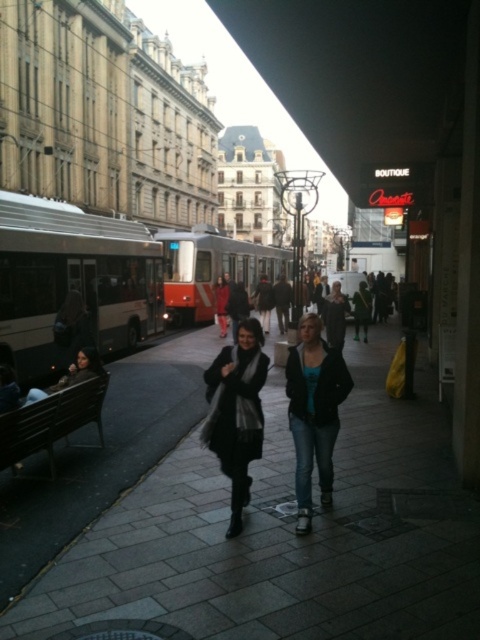
Question: Which of the following is the farthest from the observer?

Choices:
 (A) black wool scarf at center
 (B) jeans at center

Answer: (B)

Question: Which object appears farthest from the camera in this image?

Choices:
 (A) dark blue jeans at center
 (B) dark gray paving stones at center
 (C) jeans at center
 (D) black wool scarf at center

Answer: (A)

Question: Does jeans at center appear under dark blue jeans at center?

Choices:
 (A) yes
 (B) no

Answer: (A)

Question: In this image, where is orange metallic bus at center located relative to dark blue jeans at center?

Choices:
 (A) above
 (B) below

Answer: (A)

Question: Is jeans at center further to the viewer compared to orange metallic bus at center?

Choices:
 (A) yes
 (B) no

Answer: (B)

Question: Which object appears closest to the camera in this image?

Choices:
 (A) black wool scarf at center
 (B) silver metallic bus at left
 (C) dark blue jeans at center

Answer: (A)